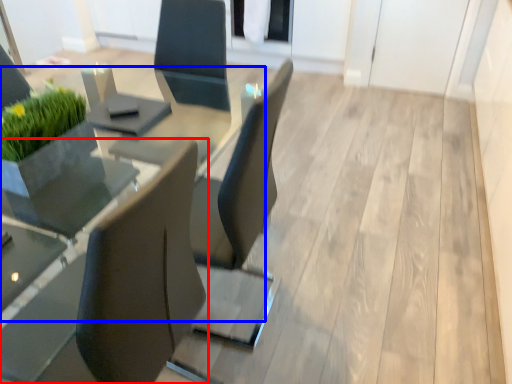
Question: Among these objects, which one is farthest to the camera, chair (highlighted by a red box) or round table (highlighted by a blue box)?

Choices:
 (A) chair
 (B) round table

Answer: (B)